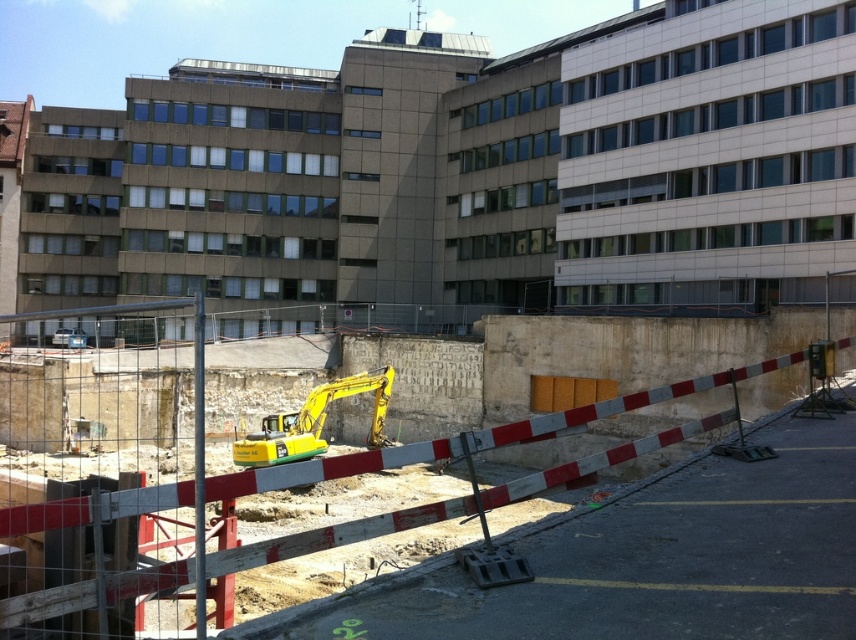
Question: Does yellow metal excavator at center have a smaller size compared to yellow metallic excavator at center?

Choices:
 (A) yes
 (B) no

Answer: (B)

Question: Does yellow metal excavator at center appear on the left side of yellow metallic excavator at center?

Choices:
 (A) yes
 (B) no

Answer: (B)

Question: Among these points, which one is nearest to the camera?

Choices:
 (A) (608, 416)
 (B) (318, 412)

Answer: (A)

Question: Which point is farther to the camera?

Choices:
 (A) (286, 436)
 (B) (230, 474)

Answer: (A)

Question: Is yellow metal excavator at center to the left of yellow metallic excavator at center from the viewer's perspective?

Choices:
 (A) yes
 (B) no

Answer: (B)